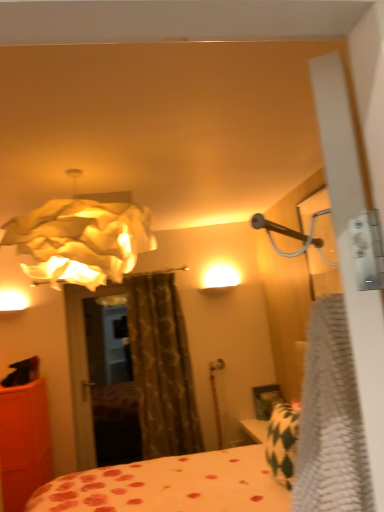
Question: Considering the relative positions of orange matte cabinet at left and white textured blanket at right in the image provided, is orange matte cabinet at left in front of white textured blanket at right?

Choices:
 (A) no
 (B) yes

Answer: (A)

Question: From the image's perspective, is orange matte cabinet at left on white textured blanket at right?

Choices:
 (A) yes
 (B) no

Answer: (B)

Question: Does orange matte cabinet at left have a lesser width compared to white textured blanket at right?

Choices:
 (A) yes
 (B) no

Answer: (B)

Question: From a real-world perspective, is orange matte cabinet at left located higher than white textured blanket at right?

Choices:
 (A) yes
 (B) no

Answer: (B)

Question: Does orange matte cabinet at left appear on the left side of white textured blanket at right?

Choices:
 (A) yes
 (B) no

Answer: (A)

Question: Does orange matte cabinet at left have a larger size compared to white textured blanket at right?

Choices:
 (A) yes
 (B) no

Answer: (A)

Question: Is white paper lampshade at upper left positioned in front of polka dot fabric bed at center?

Choices:
 (A) no
 (B) yes

Answer: (A)

Question: Is white paper lampshade at upper left not close to polka dot fabric bed at center?

Choices:
 (A) no
 (B) yes

Answer: (B)

Question: From a real-world perspective, is white paper lampshade at upper left on top of polka dot fabric bed at center?

Choices:
 (A) yes
 (B) no

Answer: (A)

Question: Considering the relative sizes of white paper lampshade at upper left and polka dot fabric bed at center in the image provided, is white paper lampshade at upper left taller than polka dot fabric bed at center?

Choices:
 (A) no
 (B) yes

Answer: (A)

Question: Considering the relative positions of white paper lampshade at upper left and polka dot fabric bed at center in the image provided, is white paper lampshade at upper left to the left of polka dot fabric bed at center from the viewer's perspective?

Choices:
 (A) no
 (B) yes

Answer: (B)

Question: Is white paper lampshade at upper left facing away from polka dot fabric bed at center?

Choices:
 (A) no
 (B) yes

Answer: (A)

Question: Would you say orange matte cabinet at left is part of white textured blanket at right's contents?

Choices:
 (A) yes
 (B) no

Answer: (B)